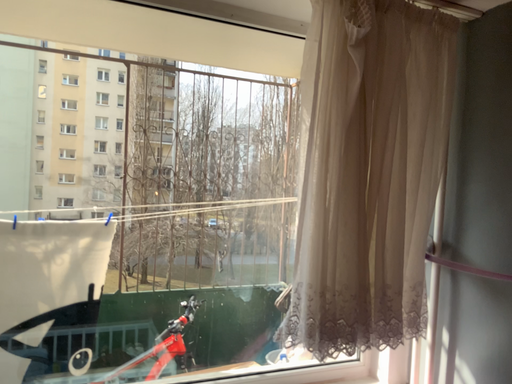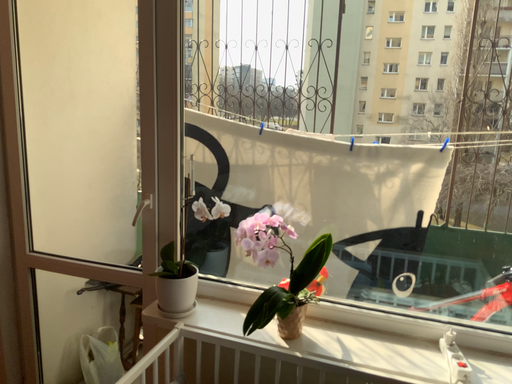
Question: Which way did the camera rotate in the video?

Choices:
 (A) rotated downward
 (B) rotated upward

Answer: (A)